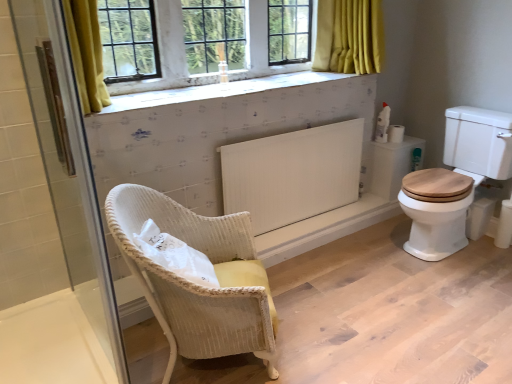
Find the location of a particular element. The image size is (512, 384). vacant space to the left of white wicker rocking chair at right is located at coordinates click(x=370, y=255).